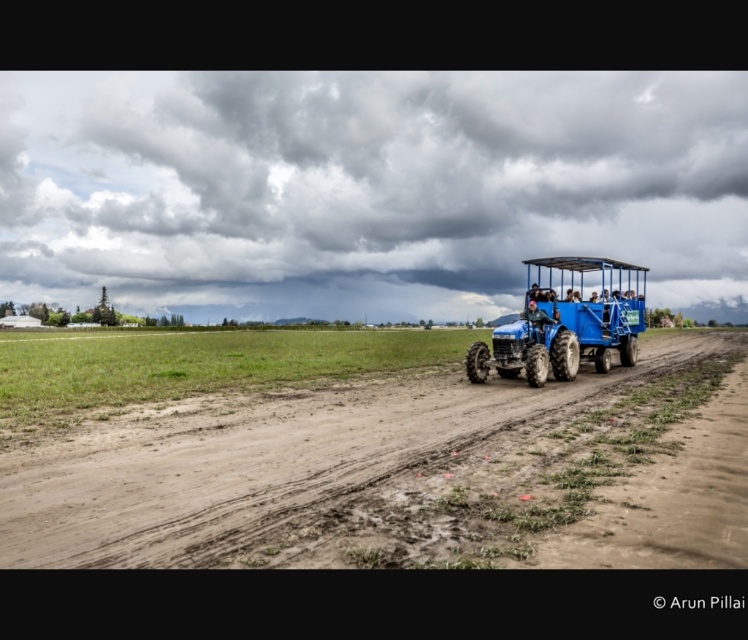
Based on the photo, you are standing at the edge of the dirt path and want to reach the dirt field at center. Which direction should you walk to get there?

The dirt field at center is located at point (280, 460), so you should walk towards the center of the image to reach it.

Consider the image. You are a farmer planning to drive the blue matte tractor at center across the dirt field at center. Based on the scene, can you determine if the tractor will be able to move forward without getting stuck?

The dirt field at center is in front of the blue matte tractor at center, which means the tractor is positioned on the edge of the field. Since the tractor is designed for offroad conditions, it should be capable of moving forward across the dirt field at center without getting stuck.